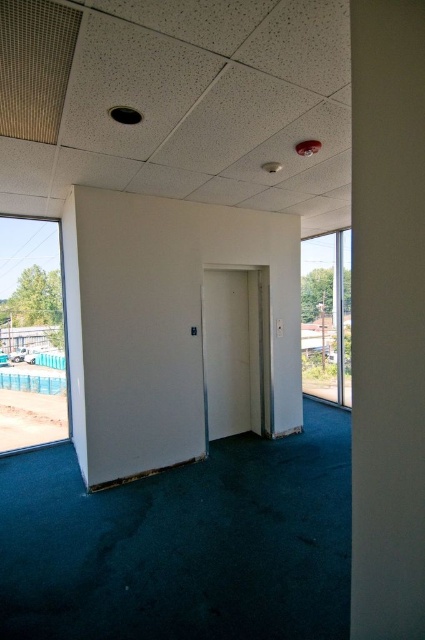
Can you confirm if white smooth pillar at right is thinner than blue plastic pool at lower left?

Yes, white smooth pillar at right is thinner than blue plastic pool at lower left.

Between white smooth pillar at right and blue plastic pool at lower left, which one is positioned higher?

white smooth pillar at right is higher up.

This screenshot has width=425, height=640. I want to click on white smooth pillar at right, so click(x=388, y=317).

Which is in front, point (22, 284) or point (350, 380)?

Point (350, 380)

In the scene shown: Is transparent glass window at left closer to the viewer compared to transparent glass window at right?

No.

I want to click on transparent glass window at left, so click(x=31, y=336).

What do you see at coordinates (31, 336) in the screenshot? I see `transparent glass window at left` at bounding box center [31, 336].

Can you confirm if transparent glass window at left is smaller than white matte door at center?

No, transparent glass window at left is not smaller than white matte door at center.

The image size is (425, 640). Describe the element at coordinates (31, 336) in the screenshot. I see `transparent glass window at left` at that location.

Identify the location of transparent glass window at left. (31, 336).